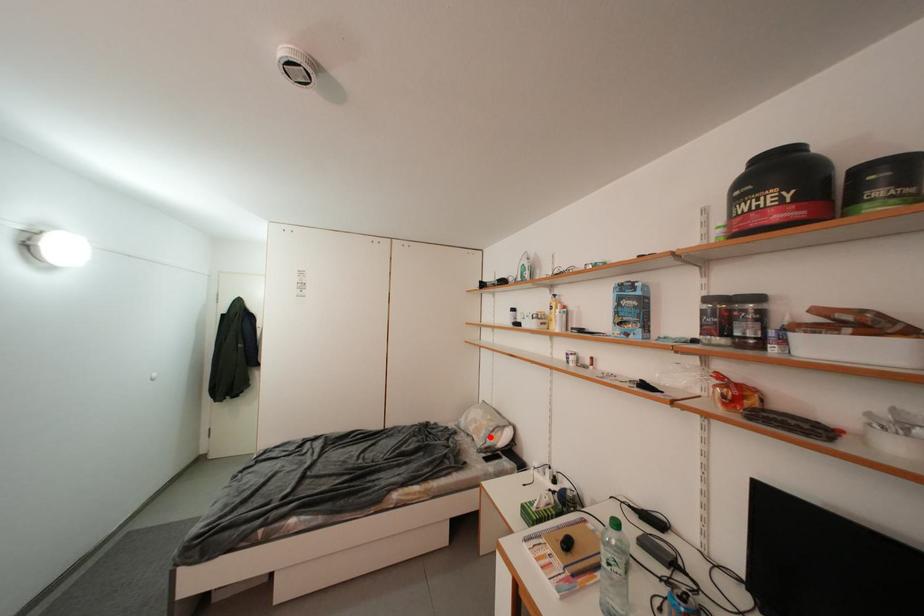
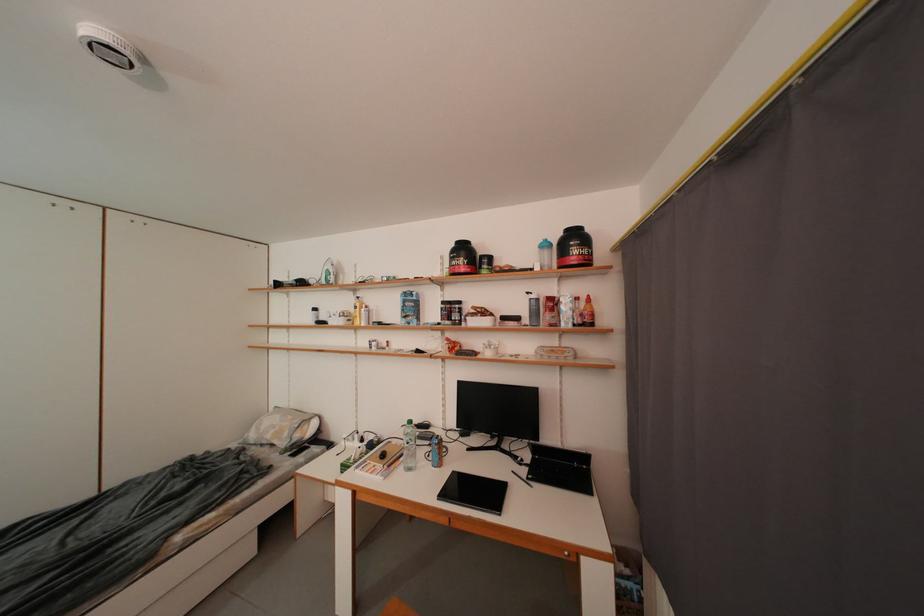
In the second image, find the point that corresponds to the highlighted location in the first image.

(294, 438)